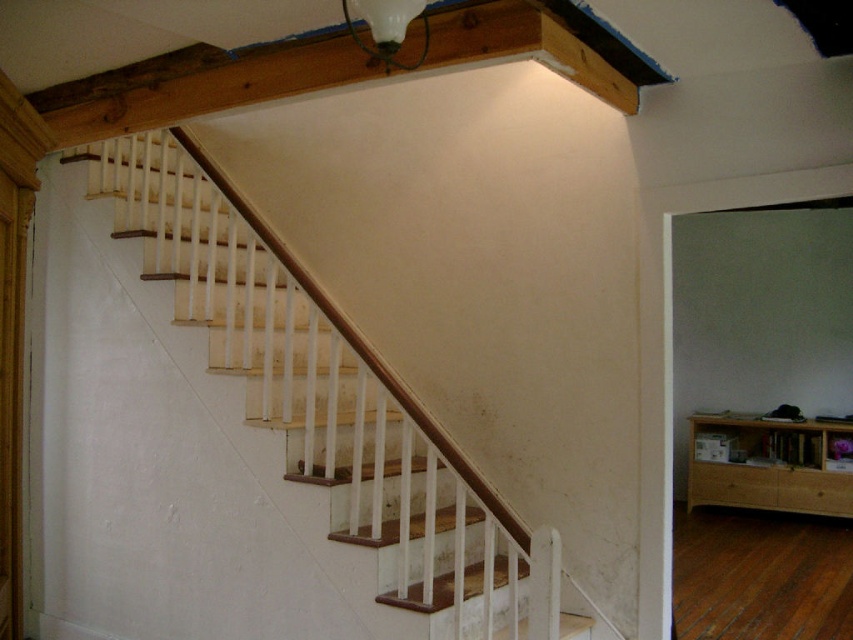
You are standing at the bottom of the staircase and want to place a small potted plant on the light brown wood at upper right marked by point [769,465]. Can you reach it without climbing the staircase?

The point [769,465] marks light brown wood at upper right, which is above the staircase. Since you are at the bottom of the staircase, you cannot reach it without climbing the stairs.

You are standing at the entrance of the room and want to go upstairs. Where should you head to locate the wooden stairs at center?

→ You should head to point (328,396) to locate the wooden stairs at center.